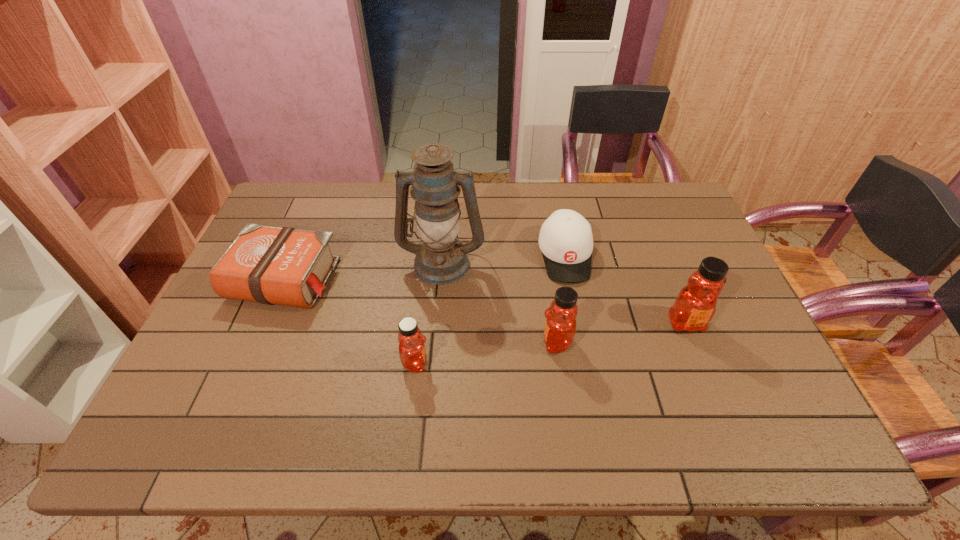
Find the location of a particular element. This screenshot has width=960, height=540. vacant area that lies between the oil lamp and the baseball cap is located at coordinates (503, 259).

I want to click on free space between the second tallest honey and the shortest honey, so click(x=486, y=353).

Identify the location of vacant region between the fourth tallest object and the second honey from right to left. The height and width of the screenshot is (540, 960). (486, 353).

Identify the location of the closest object to the baseball cap. (560, 326).

Locate which object ranks third in proximity to the tallest object. Please provide its 2D coordinates. Your answer should be formatted as a tuple, i.e. [(x, y)], where the tuple contains the x and y coordinates of a point satisfying the conditions above.

[(560, 326)]

Locate which honey ranks second in proximity to the rightmost honey. Please provide its 2D coordinates. Your answer should be formatted as a tuple, i.e. [(x, y)], where the tuple contains the x and y coordinates of a point satisfying the conditions above.

[(412, 351)]

Find the location of `honey that is the second closest one to the second honey from right to left`. honey that is the second closest one to the second honey from right to left is located at coordinates (412, 351).

Identify the location of vacant space that satisfies the following two spatial constraints: 1. on the front label of the rightmost honey; 2. on the front label of the third shortest object. Image resolution: width=960 pixels, height=540 pixels. (702, 363).

Locate an element on the screen. This screenshot has height=540, width=960. vacant space that satisfies the following two spatial constraints: 1. on the front-facing side of the baseball cap; 2. on the front label of the fourth shortest object is located at coordinates (582, 342).